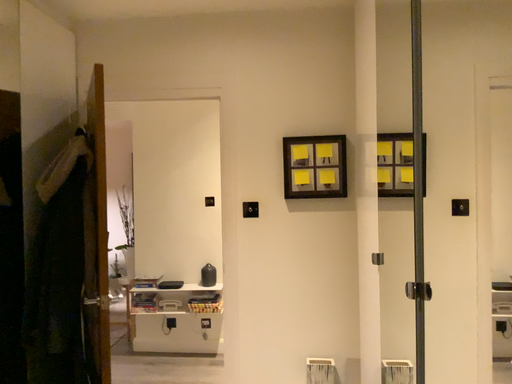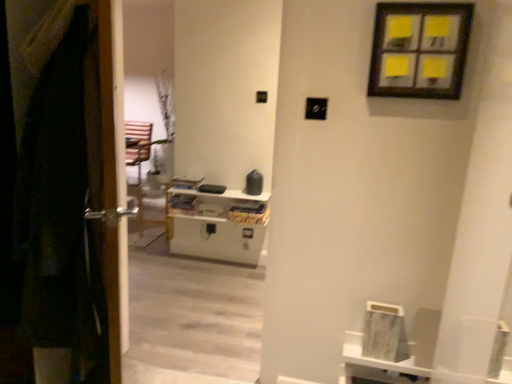
Question: Which way did the camera rotate in the video?

Choices:
 (A) rotated right
 (B) rotated left

Answer: (B)